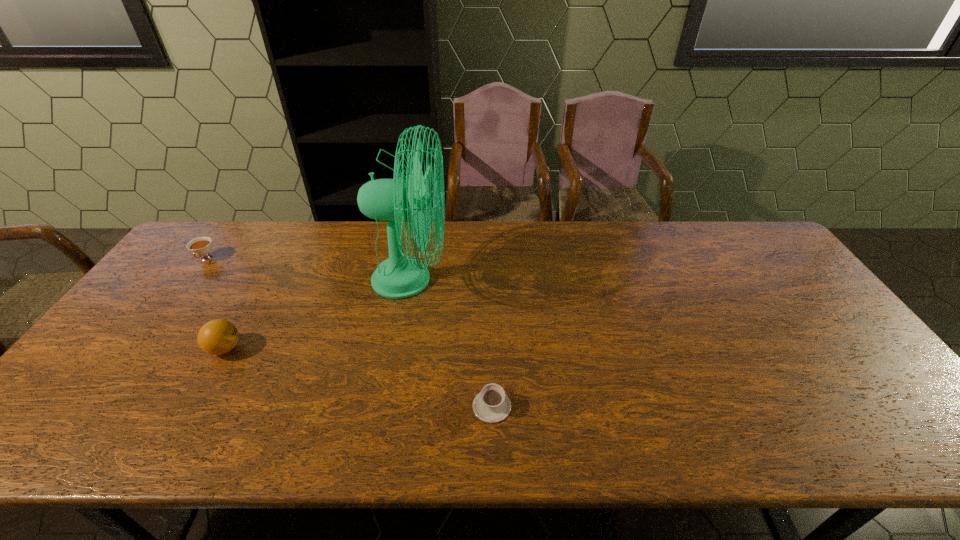
The width and height of the screenshot is (960, 540). What are the coordinates of `blank space located on the side of the farther teacup with the handle` in the screenshot? It's located at (179, 295).

The width and height of the screenshot is (960, 540). Identify the location of free region located 0.330m on the handle side of the right teacup. (490, 295).

The width and height of the screenshot is (960, 540). What are the coordinates of `vacant space located 0.380m on the handle side of the right teacup` in the screenshot? It's located at (489, 284).

Where is `free space located on the handle side of the right teacup`? The width and height of the screenshot is (960, 540). free space located on the handle side of the right teacup is located at coordinates (491, 351).

Locate an element on the screen. The width and height of the screenshot is (960, 540). fan situated at the far edge is located at coordinates (400, 276).

You are a GUI agent. You are given a task and a screenshot of the screen. Output one action in this format:
    pyautogui.click(x=<x>, y=<y>)
    Task: Click on the teacup positioned at the far edge
    This screenshot has height=540, width=960.
    Given the screenshot: What is the action you would take?
    [201, 246]

The image size is (960, 540). Find the location of `object present at the near edge`. object present at the near edge is located at coordinates (491, 405).

Locate an element on the screen. The width and height of the screenshot is (960, 540). object that is at the left edge is located at coordinates (201, 246).

I want to click on object situated at the far left corner, so click(x=201, y=246).

The height and width of the screenshot is (540, 960). In order to click on vacant region at the far edge of the desktop in this screenshot , I will do `click(318, 246)`.